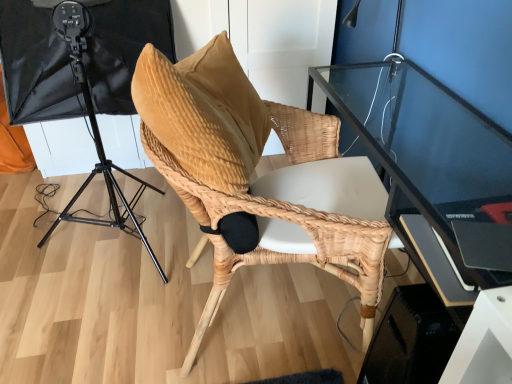
You are a GUI agent. You are given a task and a screenshot of the screen. Output one action in this format:
    pyautogui.click(x=<x>, y=<y>)
    Task: Click on the vacant area situated below natural woven chair at center (from a real-world perspective)
    The image size is (512, 384).
    Given the screenshot: What is the action you would take?
    pyautogui.click(x=273, y=309)